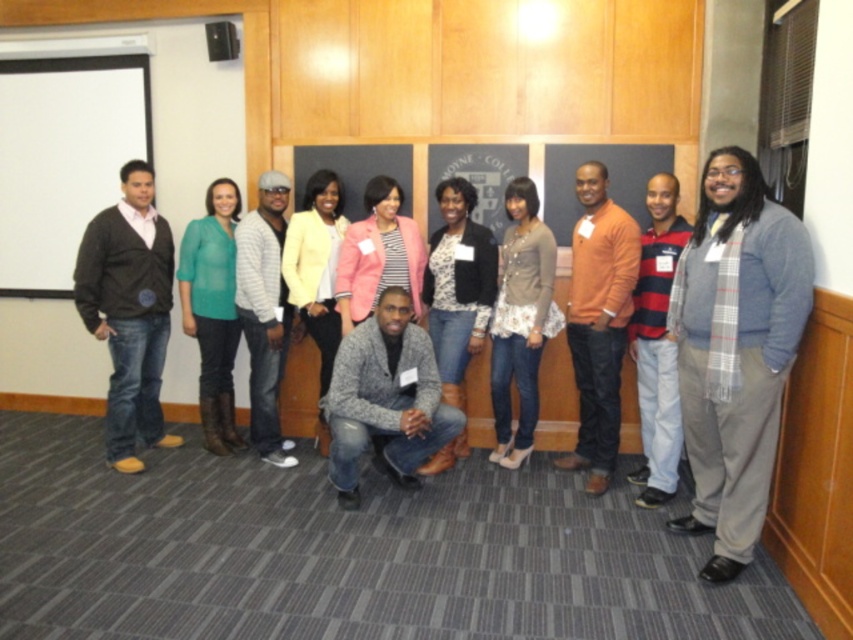
Describe the element at coordinates (386, 397) in the screenshot. I see `gray woolen sweater at center` at that location.

Who is more forward, (343, 440) or (432, 298)?

Point (343, 440)

The image size is (853, 640). Find the location of `gray woolen sweater at center`. gray woolen sweater at center is located at coordinates (386, 397).

Between gray woolen sweater at center and pink fabric jacket at center, which one is positioned higher?

pink fabric jacket at center is higher up.

Consider the image. Is gray woolen sweater at center to the right of pink fabric jacket at center from the viewer's perspective?

Indeed, gray woolen sweater at center is positioned on the right side of pink fabric jacket at center.

Measure the distance between point (x=358, y=346) and camera.

Point (x=358, y=346) is 10.73 feet from camera.

At what (x,y) coordinates should I click in order to perform the action: click on gray woolen sweater at center. Please return your answer as a coordinate pair (x, y). Image resolution: width=853 pixels, height=640 pixels. Looking at the image, I should click on (386, 397).

Between white matte projector screen at left and striped knit sweater at right, which one has less height?

white matte projector screen at left

Is the position of white matte projector screen at left less distant than that of striped knit sweater at right?

No.

You are a GUI agent. You are given a task and a screenshot of the screen. Output one action in this format:
    pyautogui.click(x=<x>, y=<y>)
    Task: Click on the white matte projector screen at left
    The image size is (853, 640).
    Given the screenshot: What is the action you would take?
    pyautogui.click(x=62, y=160)